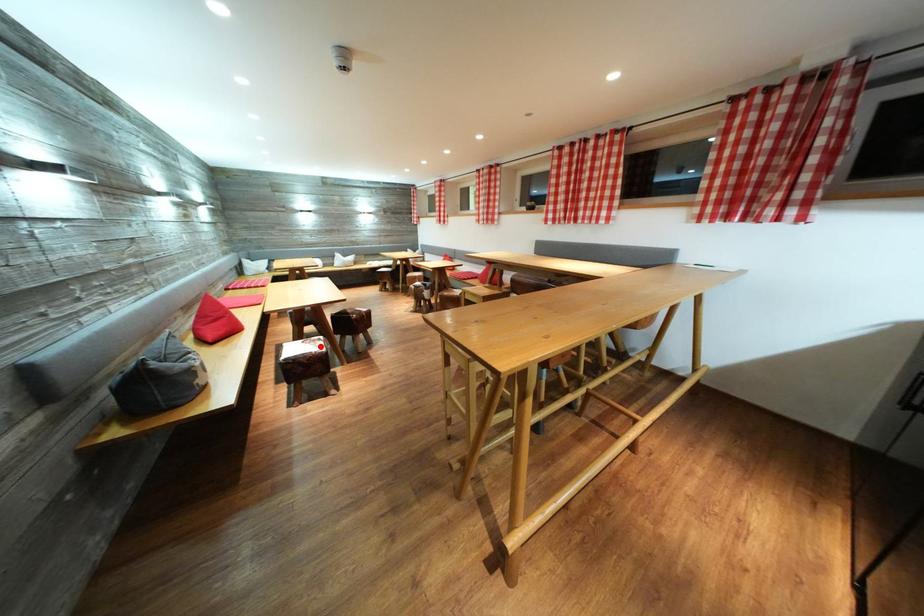
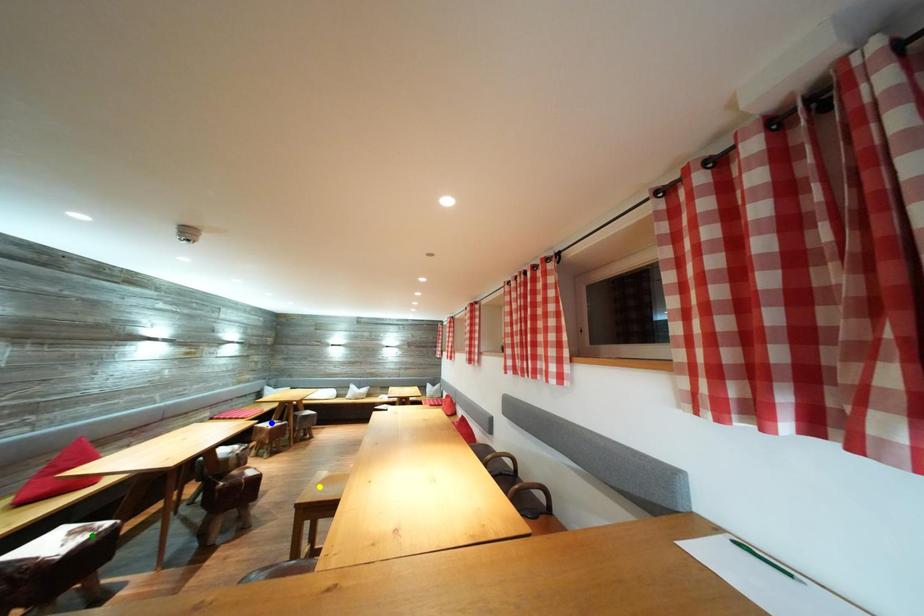
Question: I am providing you with two images of the same scene from different viewpoints. A red point is marked on the first image. You are given multiple points on the second image. Which spot in image 2 lines up with the point in image 1?

Choices:
 (A) yellow point
 (B) blue point
 (C) green point

Answer: (C)